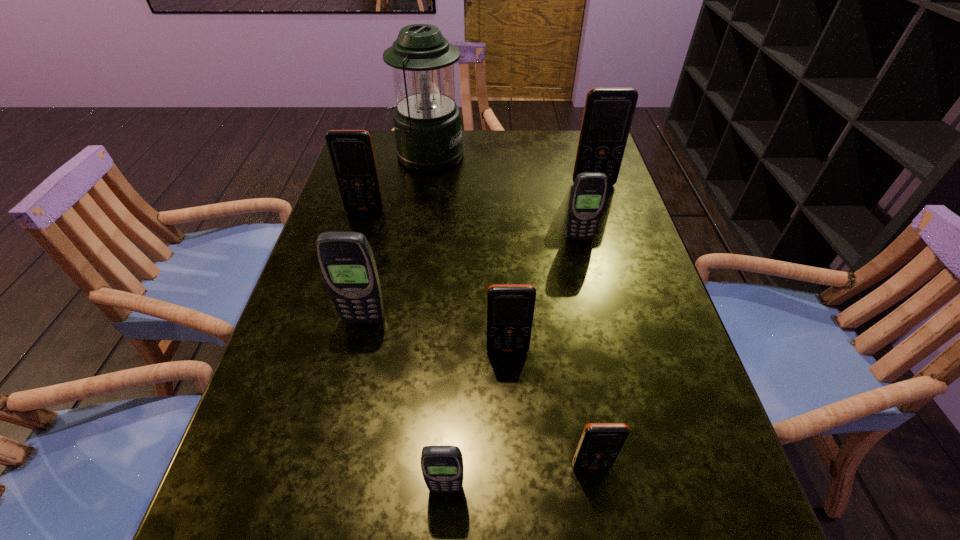
Identify the location of lantern. (427, 122).

Where is `the farthest object`? The width and height of the screenshot is (960, 540). the farthest object is located at coordinates (427, 122).

Where is `the farthest cellular telephone`? the farthest cellular telephone is located at coordinates (x=608, y=113).

Where is `the second tallest object`? the second tallest object is located at coordinates (608, 113).

The image size is (960, 540). I want to click on the third nearest orange cellular telephone, so click(351, 152).

Locate an element on the screen. This screenshot has width=960, height=540. the leftmost orange cellular telephone is located at coordinates (351, 152).

Find the location of `the biggest gray cellular telephone`. the biggest gray cellular telephone is located at coordinates (346, 260).

I want to click on the second nearest gray cellular telephone, so click(346, 260).

What are the coordinates of `the rightmost gray cellular telephone` in the screenshot? It's located at (589, 191).

Find the location of a particular element. Image resolution: width=960 pixels, height=540 pixels. the second smallest gray cellular telephone is located at coordinates (589, 191).